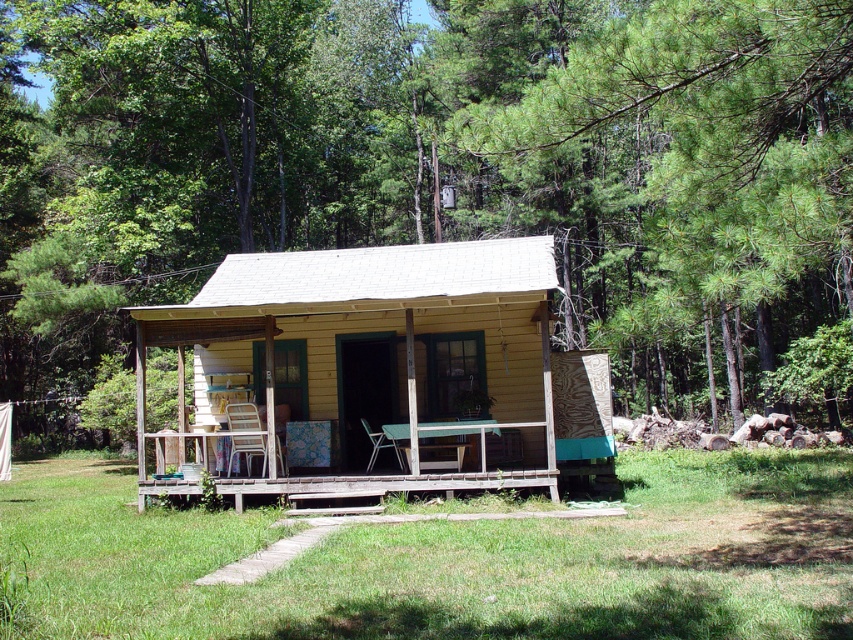
You are standing on the cabin porch and see both the metallic mesh chair at center and the metallic silver chair at center. Which one is positioned to the left side from your viewpoint?

The metallic mesh chair at center is positioned to the left of the metallic silver chair at center from your viewpoint.

You are standing on the porch of the cabin and want to know the position of the green leafy tree at upper center relative to your view. Is it to the left or right of the cabin?

The green leafy tree at upper center is located at point coordinates which place it at the upper center of the image, so from your vantage point on the cabin porch, it would be directly in front of you, neither to the left nor the right.

You are standing in front of the cabin and want to determine the relative positions of two points marked on the porch. Which point is closer to you, point [630,308] or point [496,470]?

Point [630,308] is closer to the viewer than point [496,470].